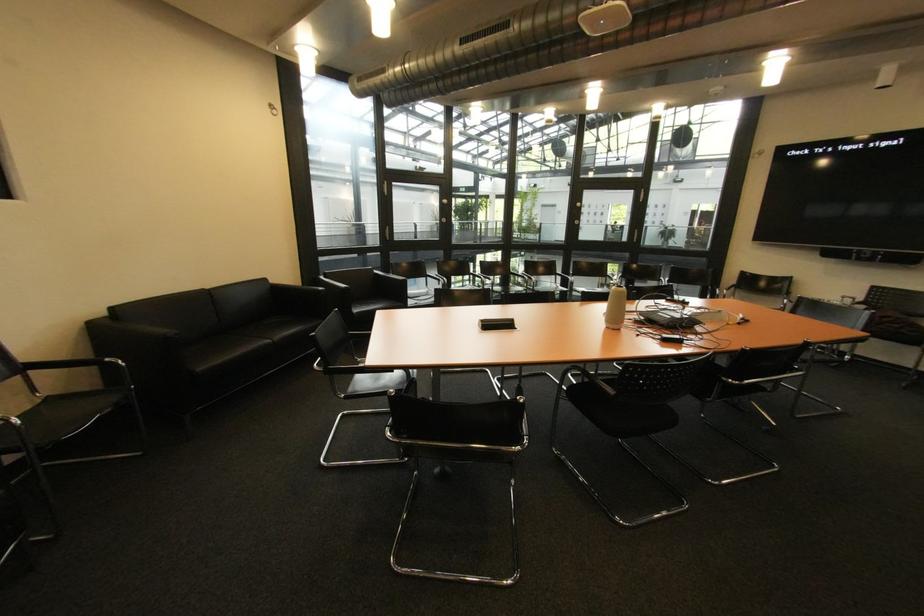
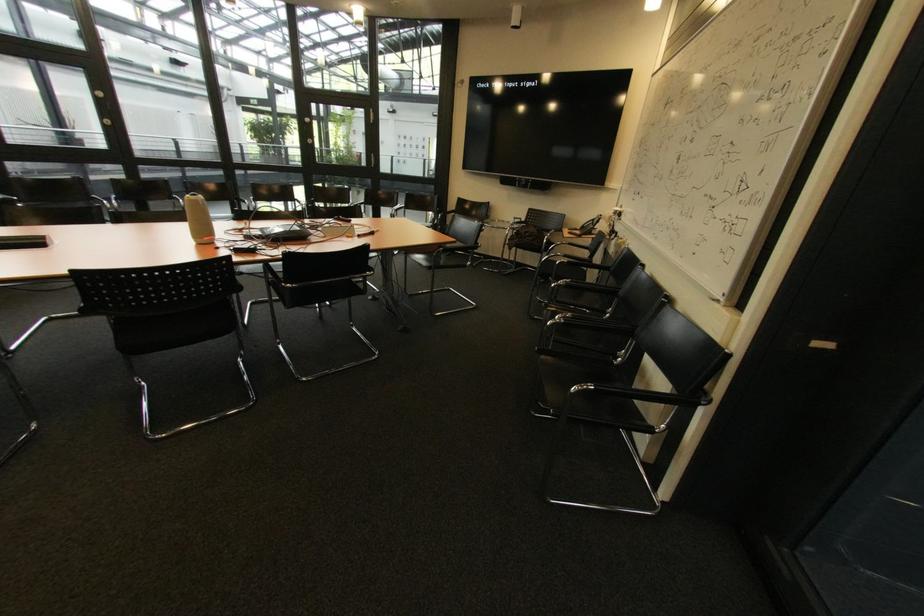
In the second image, find the point that corresponds to (x=624, y=328) in the first image.

(210, 243)